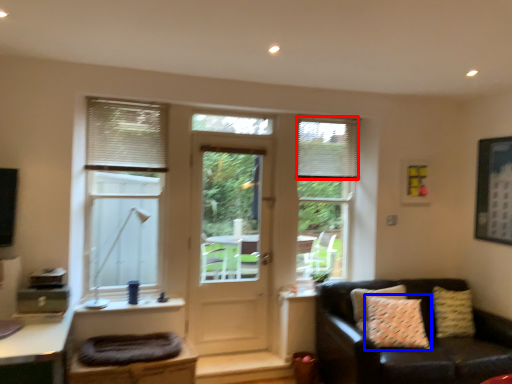
Question: Among these objects, which one is farthest to the camera, shutter (highlighted by a red box) or pillow (highlighted by a blue box)?

Choices:
 (A) shutter
 (B) pillow

Answer: (A)